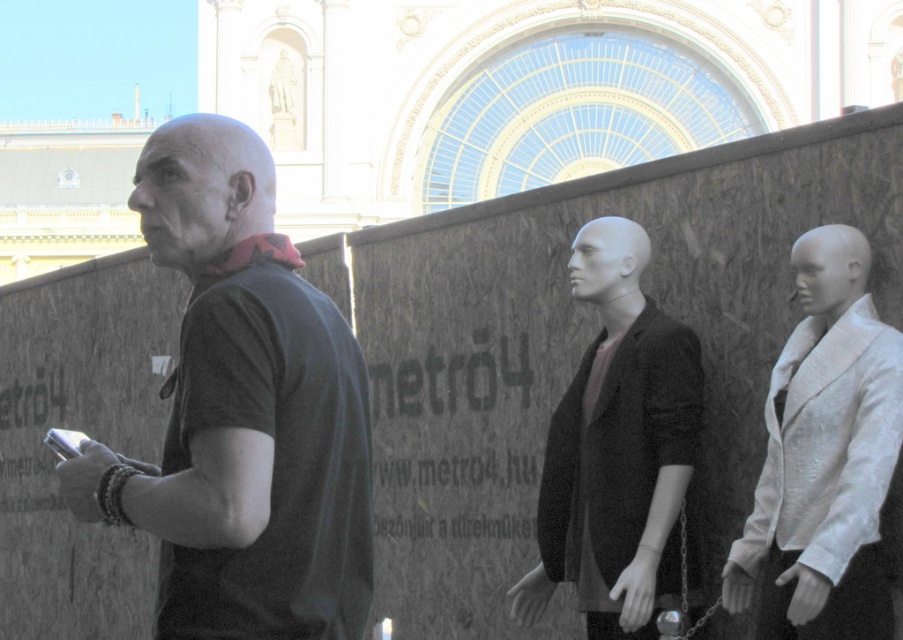
Can you confirm if dark gray t-shirt at left is wider than white silk jacket at right?

Yes.

You are a GUI agent. You are given a task and a screenshot of the screen. Output one action in this format:
    pyautogui.click(x=<x>, y=<y>)
    Task: Click on the dark gray t-shirt at left
    The width and height of the screenshot is (903, 640).
    Given the screenshot: What is the action you would take?
    pyautogui.click(x=243, y=412)

Does white silk jacket at right appear under smooth matte mannequin at center?

No, white silk jacket at right is not below smooth matte mannequin at center.

Is point (858, 483) closer to viewer compared to point (575, 552)?

Yes, point (858, 483) is closer to viewer.

Who is more distant from viewer, (825, 291) or (540, 584)?

Point (540, 584)

Identify the location of white silk jacket at right. The width and height of the screenshot is (903, 640). (824, 458).

Does dark gray t-shirt at left appear under smooth matte mannequin at center?

No.

Measure the distance from dark gray t-shirt at left to smooth matte mannequin at center.

A distance of 11.45 meters exists between dark gray t-shirt at left and smooth matte mannequin at center.

The height and width of the screenshot is (640, 903). Describe the element at coordinates (243, 412) in the screenshot. I see `dark gray t-shirt at left` at that location.

Where is `dark gray t-shirt at left`? dark gray t-shirt at left is located at coordinates (243, 412).